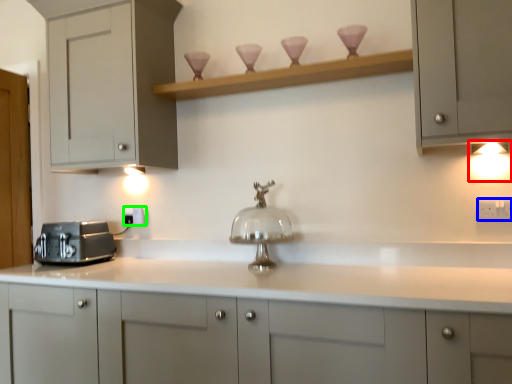
Question: Estimate the real-world distances between objects in this image. Which object is farther from light fixture (highlighted by a red box), electric outlet (highlighted by a blue box) or electric outlet (highlighted by a green box)?

Choices:
 (A) electric outlet
 (B) electric outlet

Answer: (B)